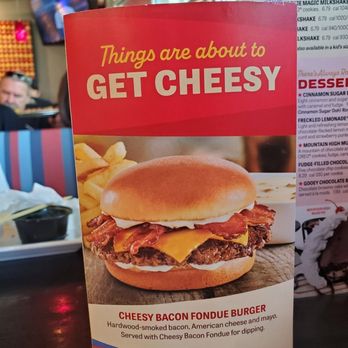
Where is `bowl`? This screenshot has width=348, height=348. bowl is located at coordinates (285, 217).